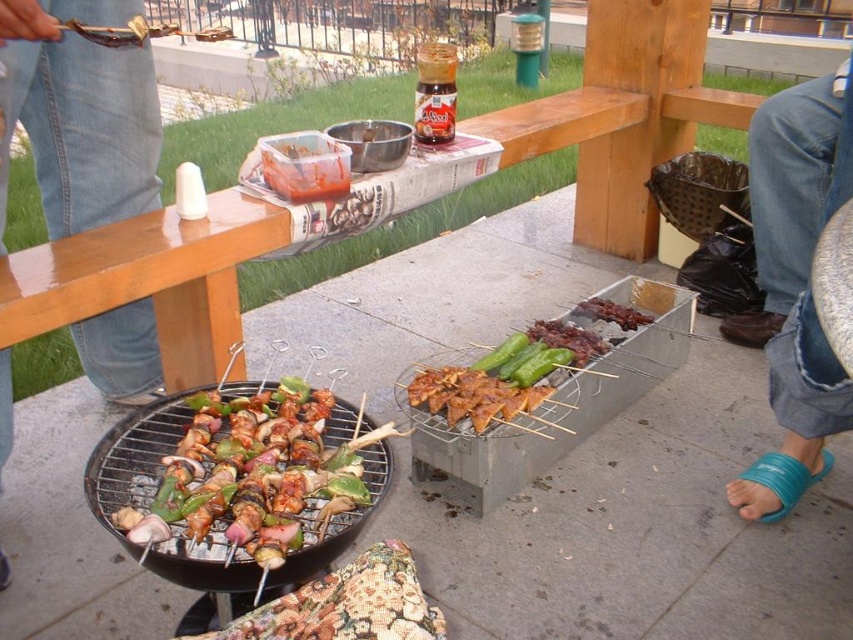
From the picture: You are planning to place a small plate on the patio. The grilled skewers at center and the blue rubber sandals at lower right are already there. Which object should you avoid placing the plate near to ensure it doesn t get dirty?

You should avoid placing the plate near the grilled skewers at center because they are actively cooking and may have grease or drippings that could dirty the plate, while the blue rubber sandals at lower right are footwear and less likely to cause mess.

You are a guest at the barbecue and want to grab your sandals to leave. The grilled skewers at center and blue rubber sandals at lower right are in your line of sight. Which object is closer to you?

The grilled skewers at center is in front of blue rubber sandals at lower right, so the grilled skewers at center is closer to you.

You are standing at the barbecue grill and want to reach both points. Which point, point [123,509] or point [585,300], is closer to you?

Point [123,509] is closer to you than point [585,300].